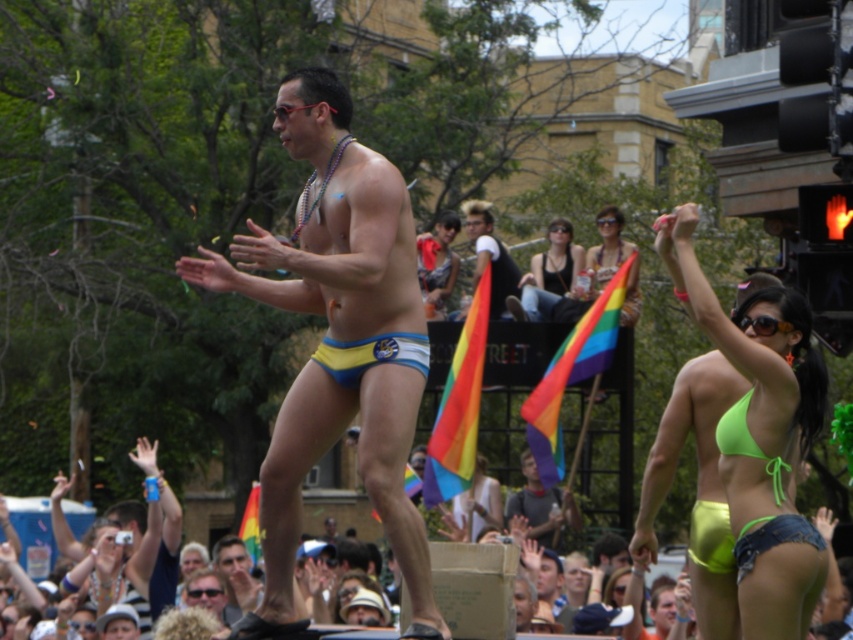
What do you see at coordinates (770, 538) in the screenshot? This screenshot has height=640, width=853. I see `neon green bikini at lower right` at bounding box center [770, 538].

Which of these two, neon green bikini at lower right or matte yellow bikini bottom at center, stands shorter?

neon green bikini at lower right

The height and width of the screenshot is (640, 853). I want to click on neon green bikini at lower right, so click(770, 538).

Who is positioned more to the left, neon green bikini at lower right or green fabric crowd at lower center?

green fabric crowd at lower center is more to the left.

Between neon green bikini at lower right and green fabric crowd at lower center, which one is positioned lower?

green fabric crowd at lower center is lower down.

What do you see at coordinates (770, 538) in the screenshot? I see `neon green bikini at lower right` at bounding box center [770, 538].

Identify the location of neon green bikini at lower right. The image size is (853, 640). (770, 538).

Between rainbow flag at upper center and neon green bikini at upper right, which one has less height?

neon green bikini at upper right is shorter.

Between rainbow flag at upper center and neon green bikini at upper right, which one is positioned lower?

rainbow flag at upper center

Who is more forward, (618, 237) or (485, 200)?

Point (618, 237)

Where is `rainbow flag at upper center`? rainbow flag at upper center is located at coordinates (607, 248).